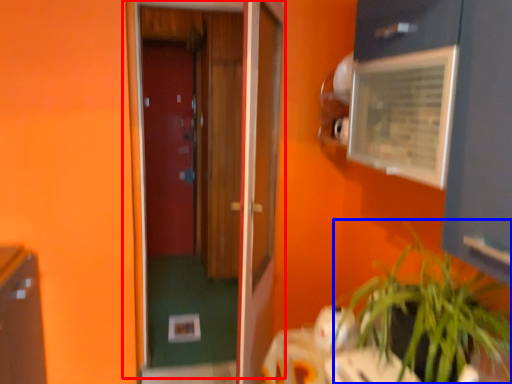
Question: Which point is closer to the camera, door (highlighted by a red box) or houseplant (highlighted by a blue box)?

Choices:
 (A) door
 (B) houseplant

Answer: (B)